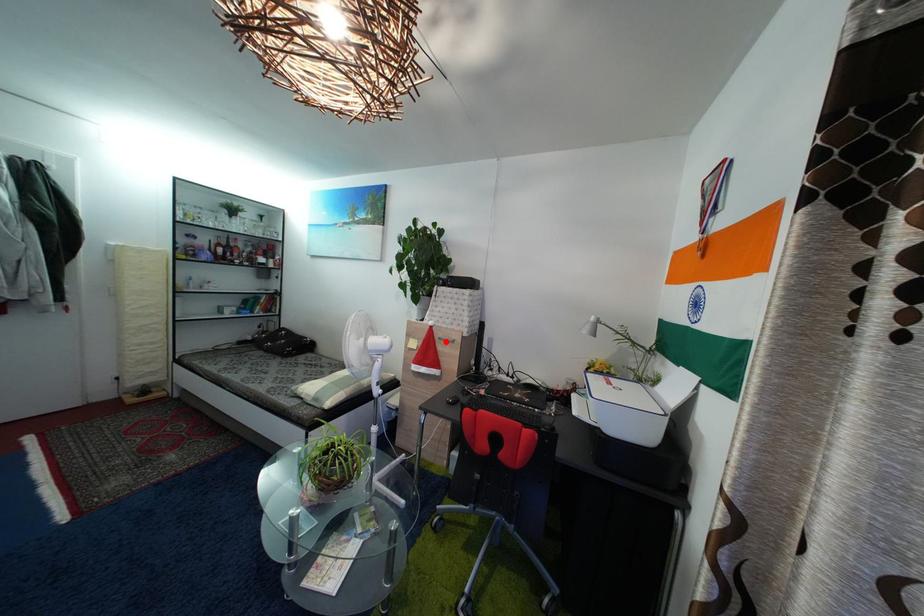
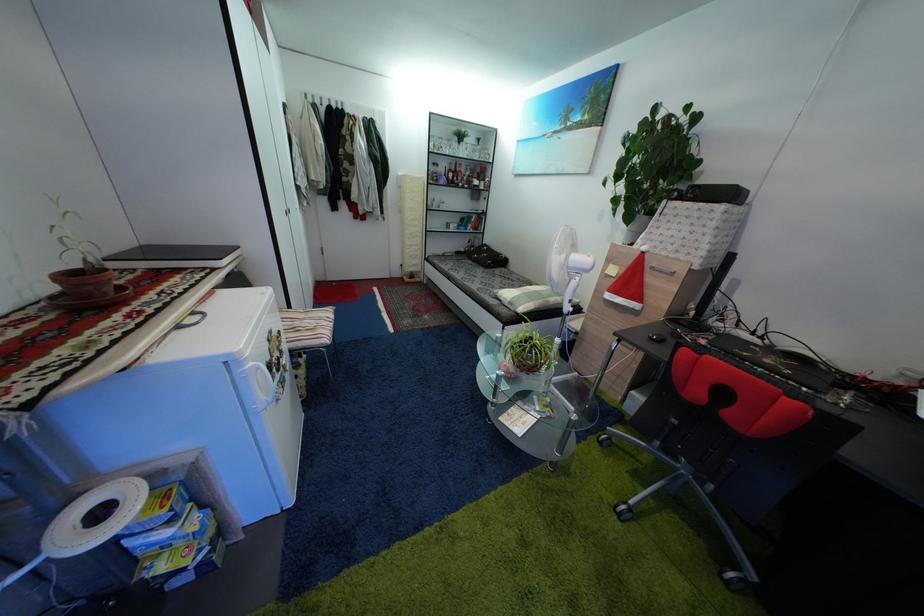
The point at the highlighted location is marked in the first image. Where is the corresponding point in the second image?

(659, 270)